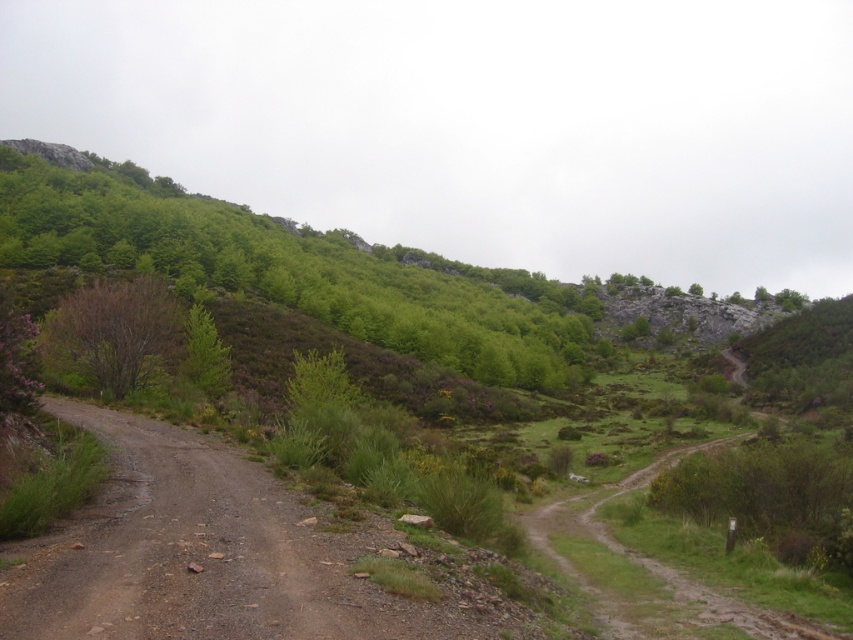
Question: Which of the following is the closest to the observer?

Choices:
 (A) brown leafless tree at left
 (B) green leafy tree at upper left

Answer: (A)

Question: Where is green leafy tree at upper left located in relation to green leafy tree at center-left in the image?

Choices:
 (A) right
 (B) left

Answer: (B)

Question: Based on their relative distances, which object is nearer to the brown leafless tree at left?

Choices:
 (A) green leafy tree at upper left
 (B) green leafy tree at center-left

Answer: (B)

Question: Is brown leafless tree at left to the left of green leafy tree at center-left from the viewer's perspective?

Choices:
 (A) no
 (B) yes

Answer: (B)

Question: Which of the following is the closest to the observer?

Choices:
 (A) (90, 205)
 (B) (209, 321)
 (C) (67, 326)

Answer: (C)

Question: Is green leafy tree at upper left positioned behind brown leafless tree at left?

Choices:
 (A) no
 (B) yes

Answer: (B)